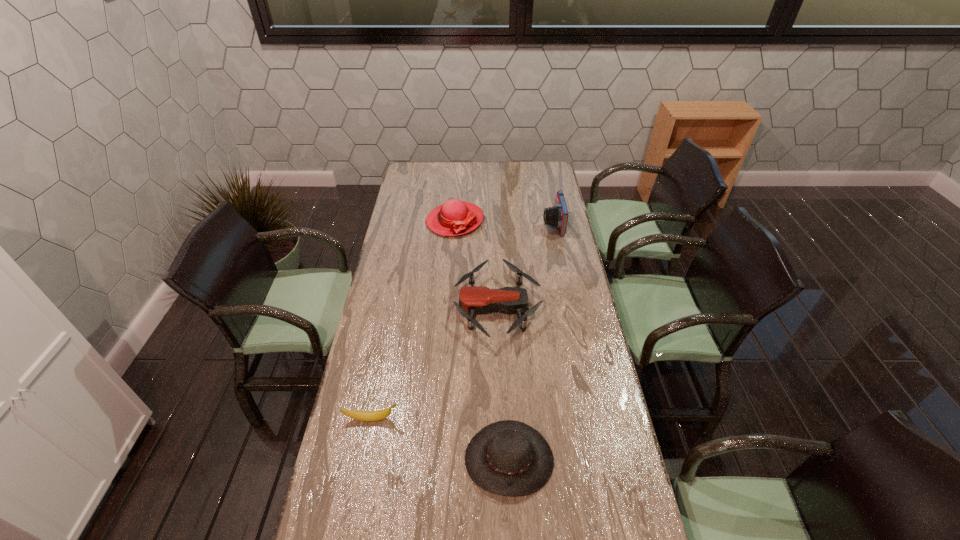
Find the location of a particular element. This screenshot has height=540, width=960. free space at the right edge of the desktop is located at coordinates (571, 278).

Locate an element on the screen. This screenshot has height=540, width=960. unoccupied position between the third farthest object and the rightmost object is located at coordinates (525, 266).

I want to click on free space between the drone and the camera, so click(x=525, y=266).

This screenshot has width=960, height=540. I want to click on free space between the drone and the farther hat, so click(x=476, y=264).

This screenshot has width=960, height=540. What are the coordinates of `free space between the banana and the rightmost object` in the screenshot? It's located at (462, 321).

At what (x,y) coordinates should I click in order to perform the action: click on empty location between the nearest object and the rightmost object. Please return your answer as a coordinate pair (x, y). Image resolution: width=960 pixels, height=540 pixels. Looking at the image, I should click on (531, 341).

Where is `empty location between the nearest object and the camera`? empty location between the nearest object and the camera is located at coordinates (531, 341).

At what (x,y) coordinates should I click in order to perform the action: click on vacant point located between the drone and the camera. Please return your answer as a coordinate pair (x, y). Image resolution: width=960 pixels, height=540 pixels. Looking at the image, I should click on (525, 266).

At what (x,y) coordinates should I click in order to perform the action: click on vacant area between the second nearest object and the nearer hat. Please return your answer as a coordinate pair (x, y). The image size is (960, 540). Looking at the image, I should click on (441, 439).

You are a GUI agent. You are given a task and a screenshot of the screen. Output one action in this format:
    pyautogui.click(x=<x>, y=<y>)
    Task: Click on the vacant area that lies between the rightmost object and the shorter hat
    The width and height of the screenshot is (960, 540).
    Given the screenshot: What is the action you would take?
    pyautogui.click(x=531, y=341)